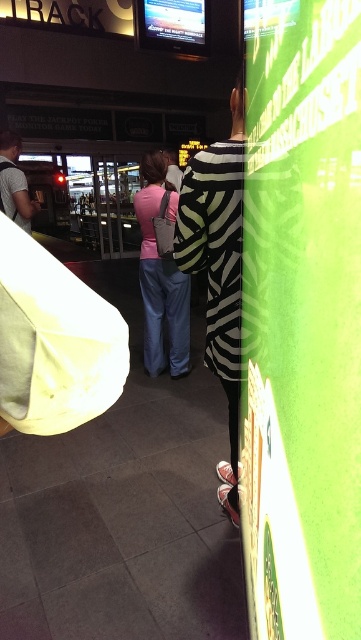
You are navigating through the train station and need to reach a specific point. You are currently at point [28,202]. There is an obstacle at point [177,250]. Can you safely walk around the obstacle to reach your destination?

Point [177,250] is in front of point [28,202], so you cannot safely walk around the obstacle to reach your destination as the obstacle is blocking your path.

You are standing in a public transportation hub and need to locate your pink fabric purse at center. According to the image, where exactly is it located?

The pink fabric purse at center is located at point (162, 273).